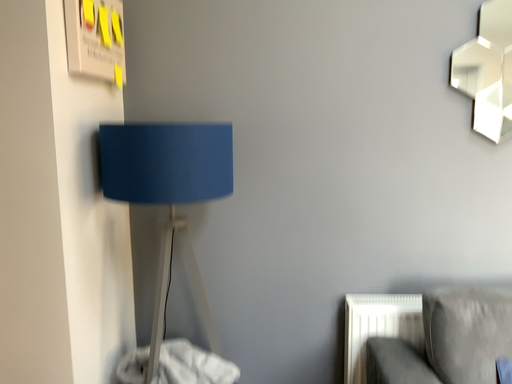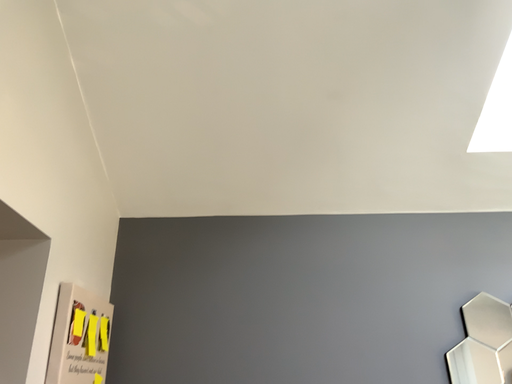
Question: Which way did the camera rotate in the video?

Choices:
 (A) rotated upward
 (B) rotated downward

Answer: (A)